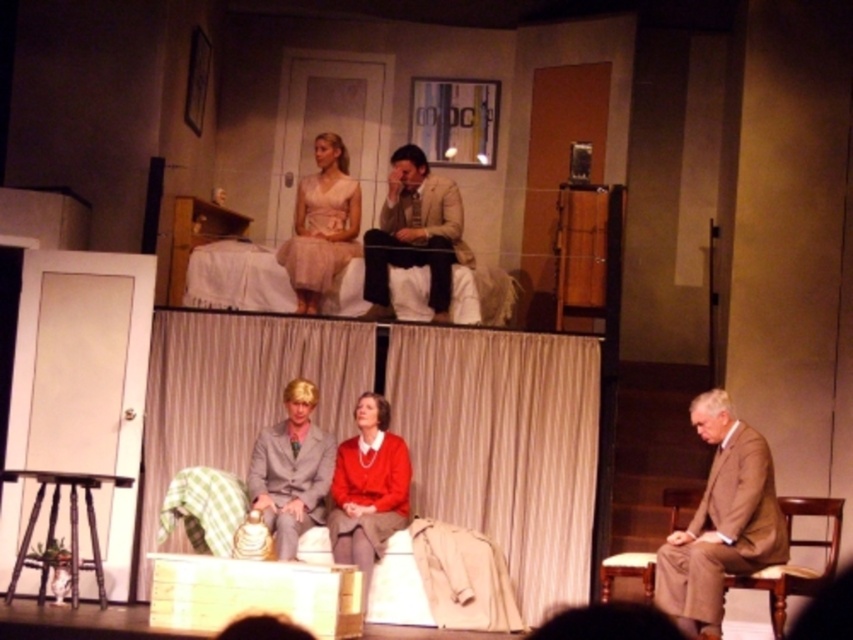
Question: Which object is the farthest from the gray wool suit at center?

Choices:
 (A) tan wool suit at lower right
 (B) matte pink dress at upper center

Answer: (A)

Question: Which of the following is the closest to the observer?

Choices:
 (A) gray wool suit at center
 (B) matte red sweater at center

Answer: (A)

Question: Is matte red sweater at center bigger than light brown wooden chair at lower right?

Choices:
 (A) yes
 (B) no

Answer: (B)

Question: Which of the following is the closest to the observer?

Choices:
 (A) matte pink dress at upper center
 (B) matte red sweater at center
 (C) light beige fabric suit at center

Answer: (B)

Question: Can you confirm if light beige fabric suit at center is positioned to the right of matte pink dress at upper center?

Choices:
 (A) no
 (B) yes

Answer: (B)

Question: Is matte red sweater at center positioned in front of matte pink dress at upper center?

Choices:
 (A) yes
 (B) no

Answer: (A)